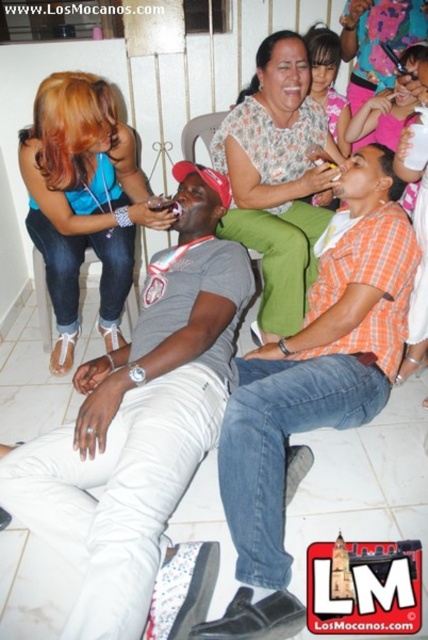
Which is more to the left, orange plaid shirt at center or matte blue tank top at upper left?

matte blue tank top at upper left is more to the left.

Is orange plaid shirt at center taller than matte blue tank top at upper left?

Yes, orange plaid shirt at center is taller than matte blue tank top at upper left.

Which is in front, point (256, 352) or point (136, 148)?

Positioned in front is point (256, 352).

Where is `orange plaid shirt at center`? orange plaid shirt at center is located at coordinates (314, 387).

Describe the element at coordinates (139, 420) in the screenshot. I see `white matte shirt at center` at that location.

Which of these two, white matte shirt at center or floral fabric blouse at center, stands shorter?

Standing shorter between the two is floral fabric blouse at center.

Between point (127, 588) and point (244, 195), which one is positioned in front?

Point (127, 588)

Locate an element on the screen. white matte shirt at center is located at coordinates (139, 420).

Does white matte shirt at center have a lesser height compared to smooth skin face at upper center?

No, white matte shirt at center is not shorter than smooth skin face at upper center.

You are a GUI agent. You are given a task and a screenshot of the screen. Output one action in this format:
    pyautogui.click(x=<x>, y=<y>)
    Task: Click on the white matte shirt at center
    The height and width of the screenshot is (640, 428).
    Given the screenshot: What is the action you would take?
    pyautogui.click(x=139, y=420)

The width and height of the screenshot is (428, 640). In order to click on white matte shirt at center in this screenshot , I will do tap(139, 420).